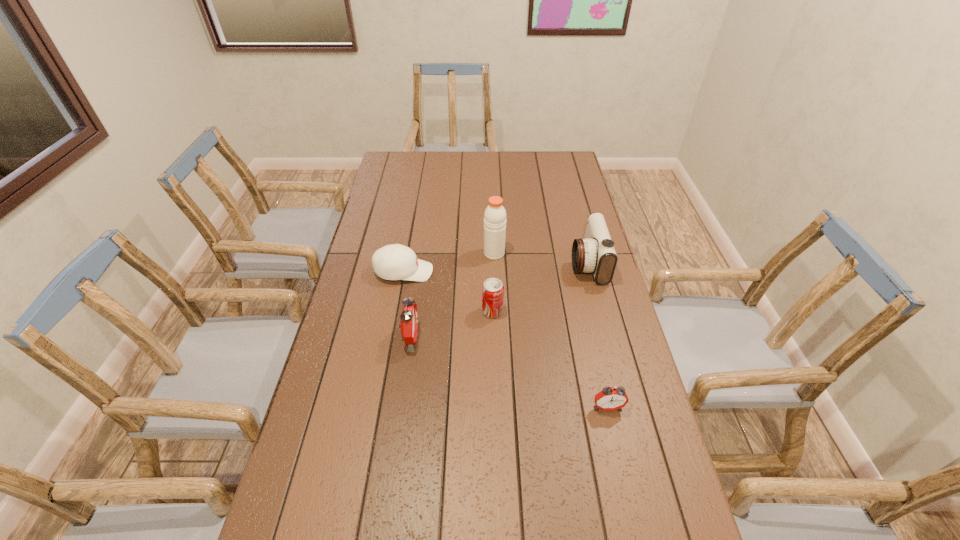
At what (x,y) coordinates should I click in order to perform the action: click on empty location between the tallest object and the nearest object. Please return your answer as a coordinate pair (x, y). Looking at the image, I should click on (551, 330).

The width and height of the screenshot is (960, 540). In order to click on free space that is in between the camcorder and the shaker in this screenshot , I will do `click(540, 258)`.

Choose which object is the third nearest neighbor to the nearest object. Please provide its 2D coordinates. Your answer should be formatted as a tuple, i.e. [(x, y)], where the tuple contains the x and y coordinates of a point satisfying the conditions above.

[(409, 321)]

Where is `object that is the second nearest to the soda can`? The width and height of the screenshot is (960, 540). object that is the second nearest to the soda can is located at coordinates (392, 262).

Image resolution: width=960 pixels, height=540 pixels. I want to click on free point that satisfies the following two spatial constraints: 1. on the front side of the shaker; 2. on the front-facing side of the baseball cap, so click(494, 272).

Locate an element on the screen. The height and width of the screenshot is (540, 960). vacant space that satisfies the following two spatial constraints: 1. on the front-facing side of the baseball cap; 2. on the left side of the third nearest object is located at coordinates (396, 311).

Find the location of a particular element. This screenshot has width=960, height=540. vacant space that satisfies the following two spatial constraints: 1. on the surface of the camcorder; 2. on the clock face of the right alarm clock is located at coordinates (625, 407).

In order to click on vacant space that satisfies the following two spatial constraints: 1. on the front side of the shaker; 2. on the front-facing side of the baseball cap in this screenshot , I will do `click(494, 272)`.